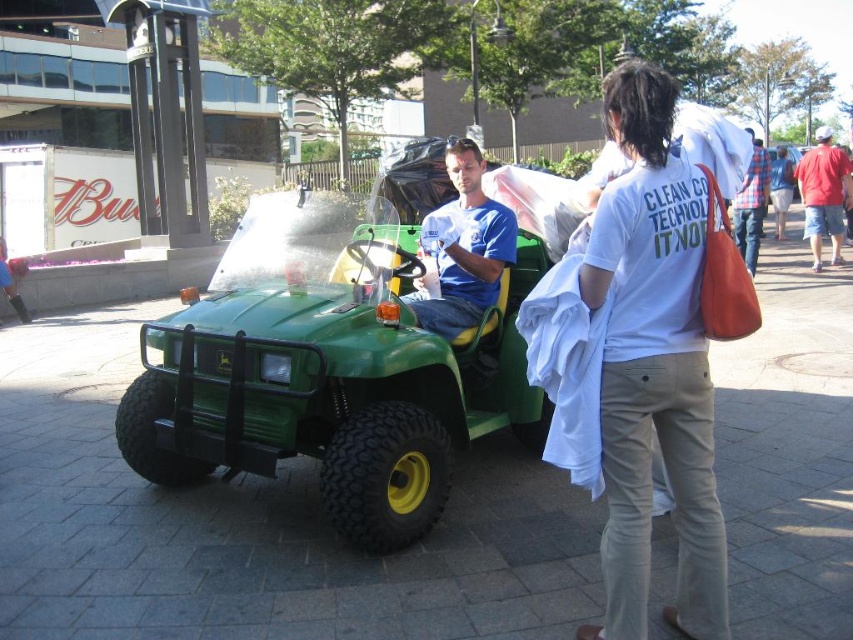
Is red cotton shirt at right further to camera compared to flannel plaid shirt at right?

That is True.

I want to click on red cotton shirt at right, so click(824, 195).

Does matte blue shirt at center have a smaller size compared to denim jacket at lower right?

Actually, matte blue shirt at center might be larger than denim jacket at lower right.

Describe the element at coordinates (463, 248) in the screenshot. I see `matte blue shirt at center` at that location.

Between point (483, 218) and point (788, 193), which one is positioned behind?

The point (788, 193) is more distant.

The image size is (853, 640). What are the coordinates of `matte blue shirt at center` in the screenshot? It's located at (463, 248).

Is green matte utility vehicle at center bigger than red cotton shirt at right?

Incorrect, green matte utility vehicle at center is not larger than red cotton shirt at right.

In order to click on green matte utility vehicle at center in this screenshot , I will do `click(329, 374)`.